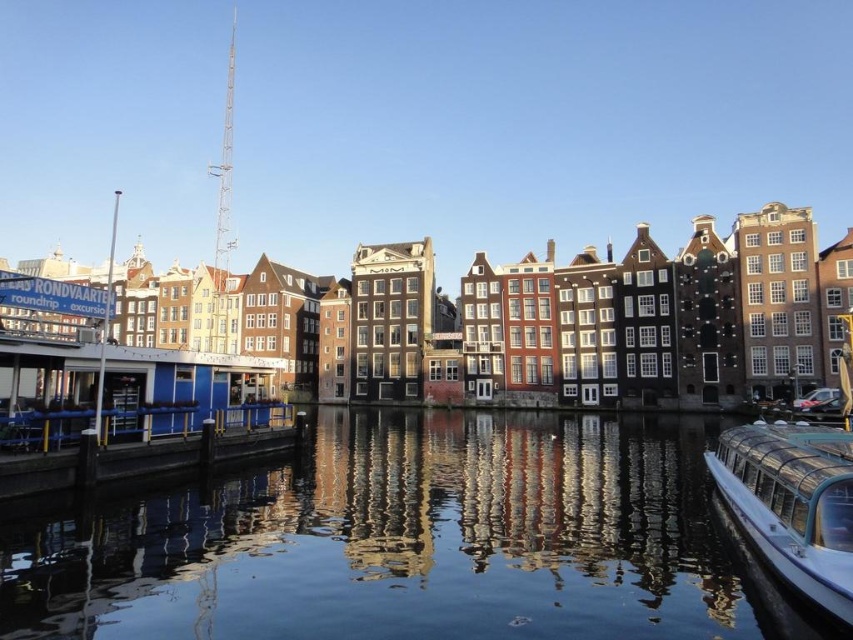
Is white glossy boat at lower right wider than smooth wooden dock at lower left?

In fact, white glossy boat at lower right might be narrower than smooth wooden dock at lower left.

Is white glossy boat at lower right below smooth wooden dock at lower left?

Yes, white glossy boat at lower right is below smooth wooden dock at lower left.

Describe the element at coordinates (793, 502) in the screenshot. I see `white glossy boat at lower right` at that location.

Identify the location of white glossy boat at lower right. (793, 502).

This screenshot has width=853, height=640. Find the location of `transparent glass water at center`. transparent glass water at center is located at coordinates (415, 541).

Is point (616, 461) behind point (811, 592)?

Yes, point (616, 461) is farther from viewer.

Which is in front, point (590, 417) or point (763, 548)?

Point (763, 548) is in front.

This screenshot has height=640, width=853. Identify the location of transparent glass water at center. (415, 541).

Which is in front, point (401, 608) or point (262, 448)?

Point (401, 608)

Can you confirm if transparent glass water at center is bigger than smooth wooden dock at lower left?

Indeed, transparent glass water at center has a larger size compared to smooth wooden dock at lower left.

Between point (119, 602) and point (93, 451), which one is positioned in front?

Point (119, 602) is more forward.

You are a GUI agent. You are given a task and a screenshot of the screen. Output one action in this format:
    pyautogui.click(x=<x>, y=<y>)
    Task: Click on the transparent glass water at center
    
    Given the screenshot: What is the action you would take?
    point(415,541)